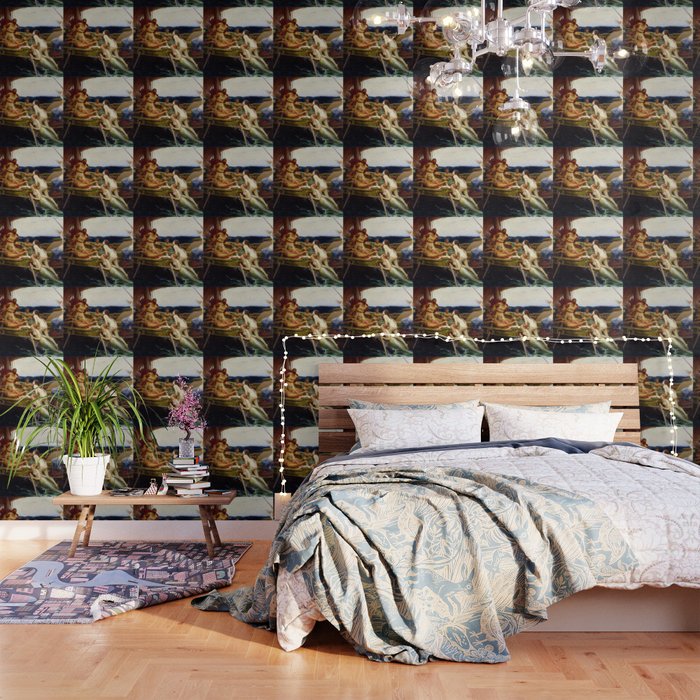
Locate an element on the screen. table is located at coordinates (125, 494).